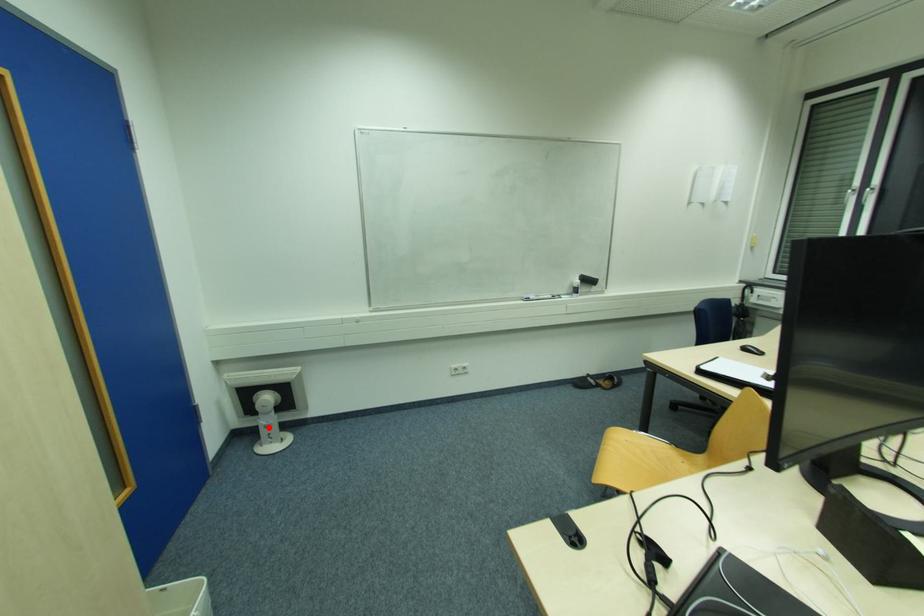
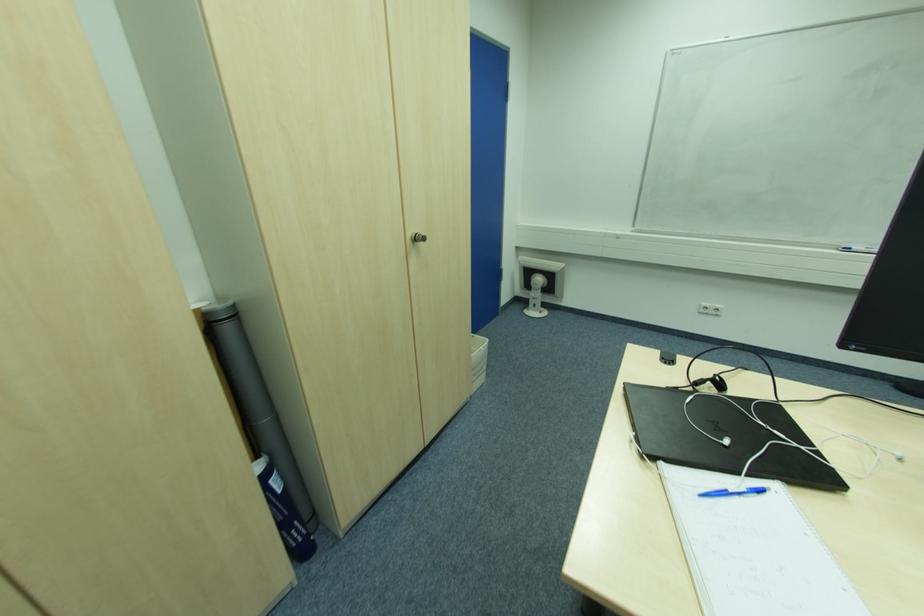
Where in the second image is the point corresponding to the highlighted location from the first image?

(536, 300)